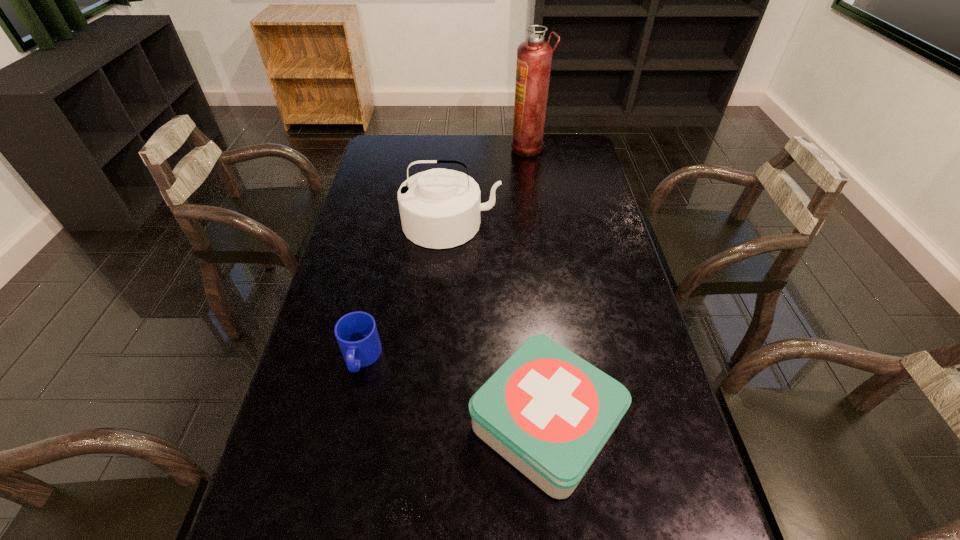
You are a GUI agent. You are given a task and a screenshot of the screen. Output one action in this format:
    pyautogui.click(x=<x>, y=<y>)
    Task: Click on the tallest object
    Image resolution: width=960 pixels, height=540 pixels.
    Given the screenshot: What is the action you would take?
    point(534,56)

Locate an element on the screen. Image resolution: width=960 pixels, height=540 pixels. fire extinguisher is located at coordinates (534, 56).

Where is `the third shortest object`? the third shortest object is located at coordinates (439, 208).

At what (x,y) coordinates should I click in order to perform the action: click on kettle. Please return your answer as a coordinate pair (x, y). This screenshot has width=960, height=540. Looking at the image, I should click on (439, 208).

At what (x,y) coordinates should I click in order to perform the action: click on the first-aid kit. Please return your answer as a coordinate pair (x, y). This screenshot has width=960, height=540. Looking at the image, I should click on (548, 412).

Identify the location of mug. (356, 332).

Where is `vacant space located on the side of the tallest object with the label`? vacant space located on the side of the tallest object with the label is located at coordinates (482, 148).

Locate an element on the screen. This screenshot has width=960, height=540. free location located 0.130m on the side of the tallest object with the label is located at coordinates (480, 148).

At what (x,y) coordinates should I click in order to perform the action: click on free space located 0.090m on the side of the tallest object with the label. Please return your answer as a coordinate pair (x, y). The height and width of the screenshot is (540, 960). Looking at the image, I should click on (490, 148).

Locate an element on the screen. free space located on the spout of the kettle is located at coordinates (448, 265).